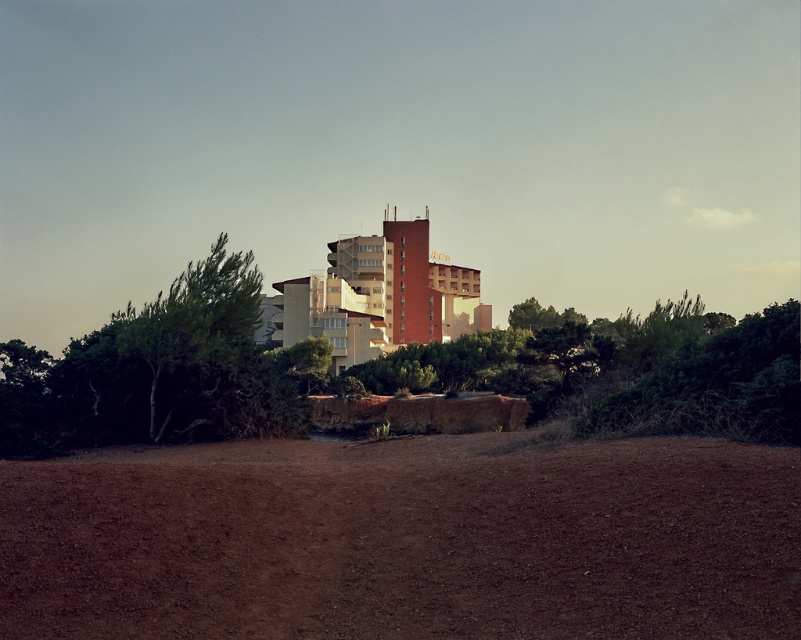
You are standing at the point marked as point (405, 540) in the image. What object is exactly at your current location?

The brown soil at lower center is located at point (405, 540).

You are a gardener planning to plant a new flower bed. You have a bag of soil that can cover an area smaller than the brown soil at lower center. Will this be enough to cover the area under the green leafy tree at left?

The brown soil at lower center has a smaller size compared to the green leafy tree at left. Therefore, the bag of soil that can cover an area smaller than the brown soil at lower center will not be sufficient to cover the area under the green leafy tree at left since it is larger.